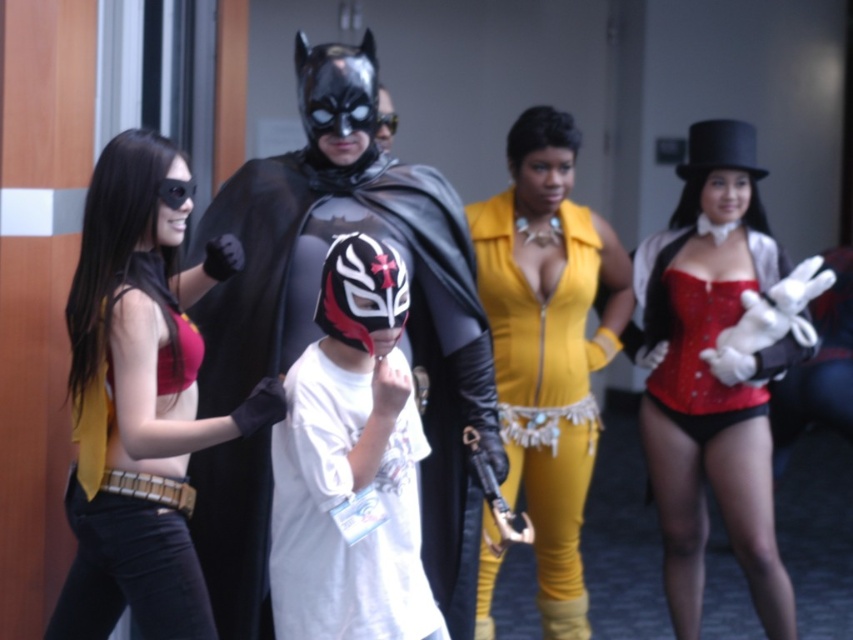
You are a photographer at the event and want to capture a photo of both the shiny black costume at center and the yellow leather jumpsuit at center. Based on their positions, which one should you focus on first to ensure both are in frame?

The shiny black costume at center is positioned on the left side of the yellow leather jumpsuit at center, so you should focus on the shiny black costume at center first to ensure both are in frame.

You are organizing a costume contest where participants must fit through a 1.2 meter wide doorway. Given the matte red top at left and yellow leather jumpsuit at center, which costume would you recommend for someone entering the contest to ensure they can pass through the doorway?

The yellow leather jumpsuit at center has a smaller width than the matte red top at left. Since the doorway is 1.2 meters wide, the yellow leather jumpsuit at center is more likely to fit through the doorway without issues.